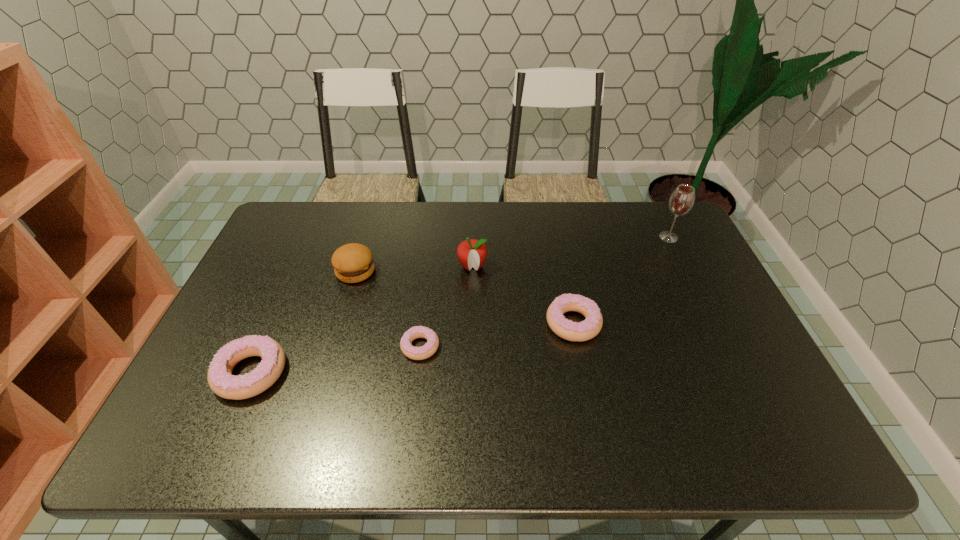
Locate an element on the screen. The image size is (960, 540). the leftmost object is located at coordinates (220, 379).

At what (x,y) coordinates should I click in order to perform the action: click on the second doughnut from left to right. Please return your answer as a coordinate pair (x, y). The height and width of the screenshot is (540, 960). Looking at the image, I should click on (416, 353).

Identify the location of the shortest doughnut. The image size is (960, 540). (416, 353).

I want to click on the fifth object from left to right, so click(573, 331).

Where is `the rightmost doughnut`? the rightmost doughnut is located at coordinates (573, 331).

The image size is (960, 540). I want to click on hamburger, so click(x=353, y=262).

At what (x,y) coordinates should I click in order to perform the action: click on the second object from left to right. Please return your answer as a coordinate pair (x, y). The height and width of the screenshot is (540, 960). Looking at the image, I should click on (353, 262).

The width and height of the screenshot is (960, 540). Find the location of `the fourth object from left to right`. the fourth object from left to right is located at coordinates (471, 253).

I want to click on the fifth shortest object, so click(471, 253).

The image size is (960, 540). I want to click on the rightmost object, so click(x=681, y=201).